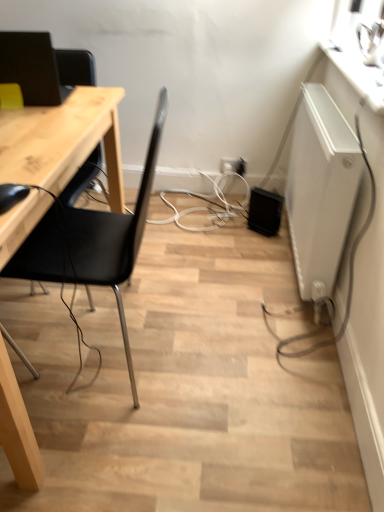
In order to click on empty space that is ontop of white matte radiator at right (from a real-world perspective) in this screenshot , I will do `click(333, 110)`.